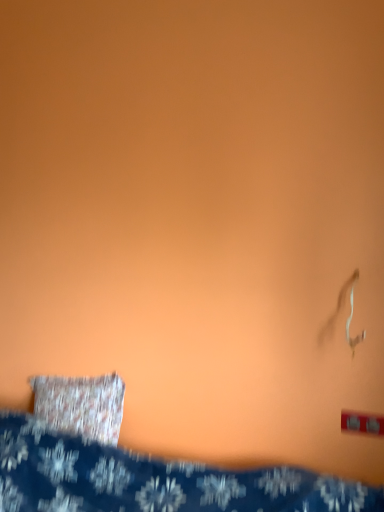
The image size is (384, 512). What do you see at coordinates (152, 480) in the screenshot?
I see `blue floral fabric at lower left` at bounding box center [152, 480].

At what (x,y) coordinates should I click in order to perform the action: click on blue floral fabric at lower left. Please return your answer as a coordinate pair (x, y). This screenshot has height=512, width=384. Looking at the image, I should click on (152, 480).

This screenshot has height=512, width=384. I want to click on blue floral fabric at lower left, so click(x=152, y=480).